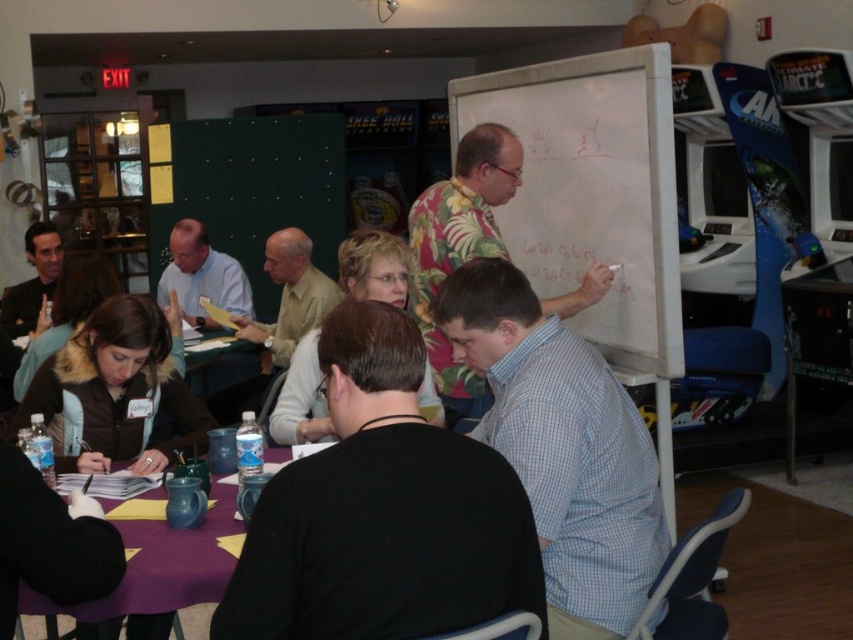
Does purple fabric table at lower center appear on the right side of matte black jacket at upper left?

Yes, purple fabric table at lower center is to the right of matte black jacket at upper left.

Is point (181, 586) behind point (10, 291)?

No, it is in front of (10, 291).

Describe the element at coordinates (161, 566) in the screenshot. I see `purple fabric table at lower center` at that location.

Locate an element on the screen. This screenshot has height=640, width=853. purple fabric table at lower center is located at coordinates (161, 566).

Which is above, blue checkered shirt at center or floral shirt at center?

Positioned higher is floral shirt at center.

I want to click on blue checkered shirt at center, so click(x=561, y=449).

Is white matte whiteboard at upper center further to the viewer compared to light brown shirt at center?

No, white matte whiteboard at upper center is in front of light brown shirt at center.

Does point (508, 96) lie behind point (281, 241)?

No, it is in front of (281, 241).

Between point (532, 93) and point (321, 284), which one is positioned in front?

Point (532, 93)

Identify the location of white matte whiteboard at upper center. (593, 193).